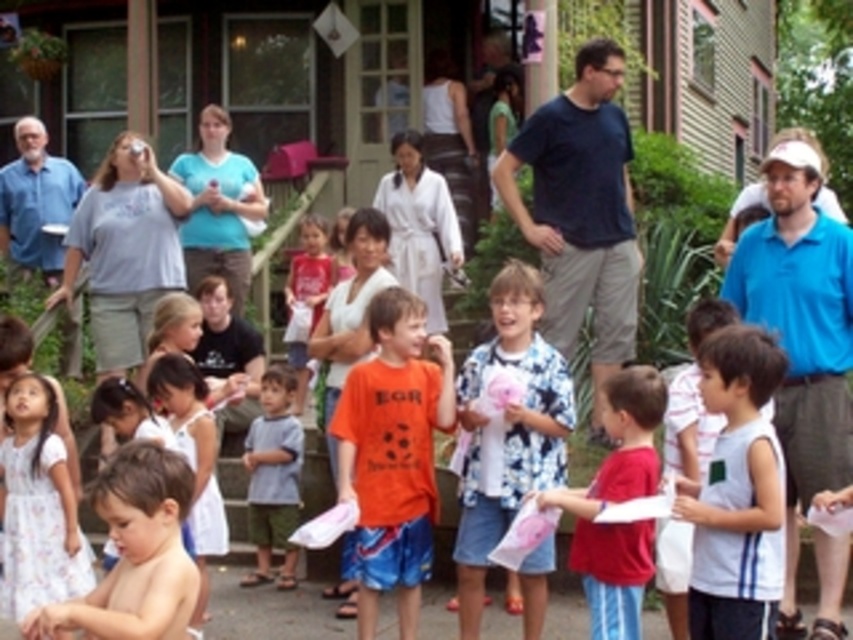
You are a photographer trying to capture a photo of both the white sleeveless shirt at center and the red cotton shirt at center. Since you want to ensure both are fully visible in the frame, which shirt should you focus on to avoid cropping the top of either?

The white sleeveless shirt at center is taller than the red cotton shirt at center, so focusing on the white sleeveless shirt at center will ensure both are fully visible without cropping the top of either.

You are standing at the position of point (71, 554) and want to throw a ball to someone at point (566, 342). Considering the spatial relationship between these two points, will the ball need to travel forward or backward from your current position?

The ball will need to travel forward from your current position at point (71, 554) to reach point (566, 342) because point (566, 342) is further to the camera than point (71, 554).